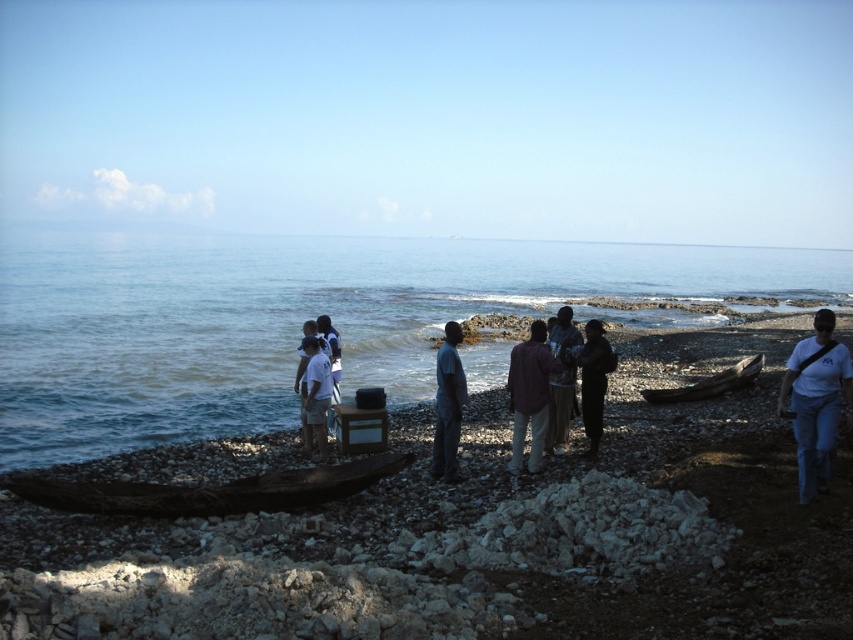
You are a hiker who needs to decide which jacket to take for a day trip. Both the dark brown leather jacket at center and the dark gray fabric jacket at center are available. Which jacket has a larger size?

The dark brown leather jacket at center is bigger than the dark gray fabric jacket at center, so the dark brown leather jacket at center has a larger size.

You are standing on the rocky shoreline and see the dark brown leather jacket at center. If you want to place a small pebble exactly 0.3 meters to the right of the jacket, where would you place it relative to the jacket?

You should place the small pebble 0.3 meters to the right of the dark brown leather jacket at center.

You are a photographer trying to capture the smooth pebbles at center and the white cotton shirt at center in the same frame. Which object should you focus on first if you want to ensure both are in focus without adjusting your camera settings?

You should focus on the smooth pebbles at center first because their larger width compared to the white cotton shirt at center means they will require a greater depth of field to keep both in focus.